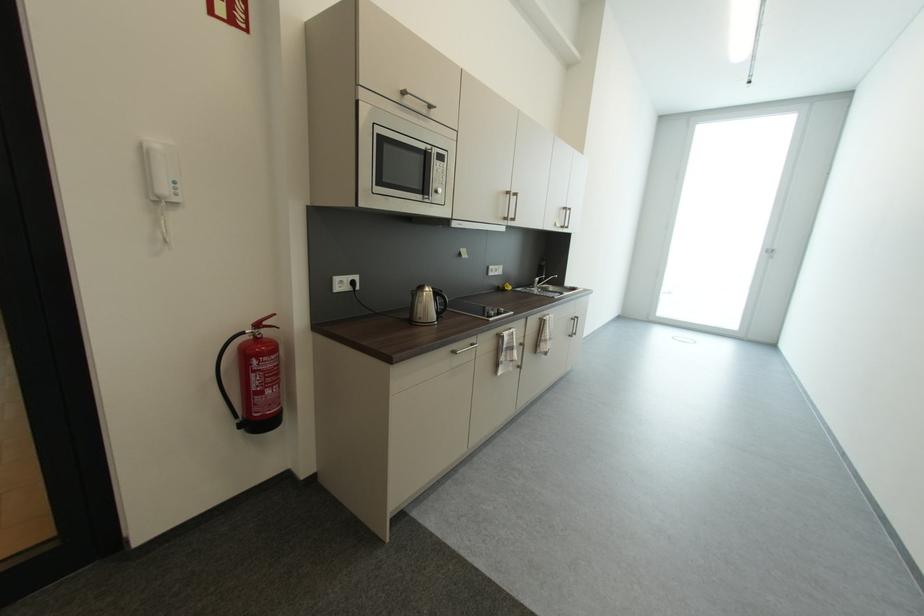
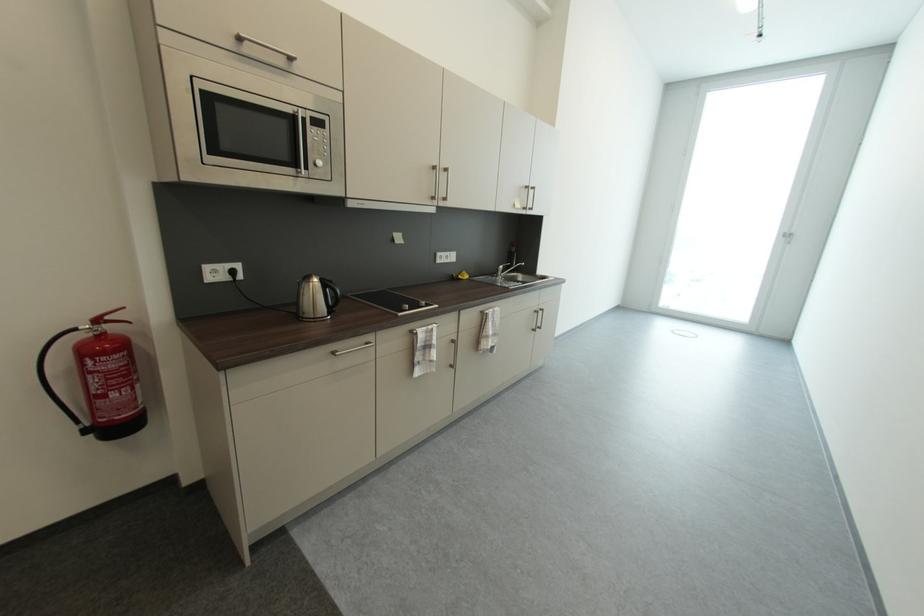
Which direction would the cameraman need to move to produce the second image?

The movement direction of the cameraman is right, forward.